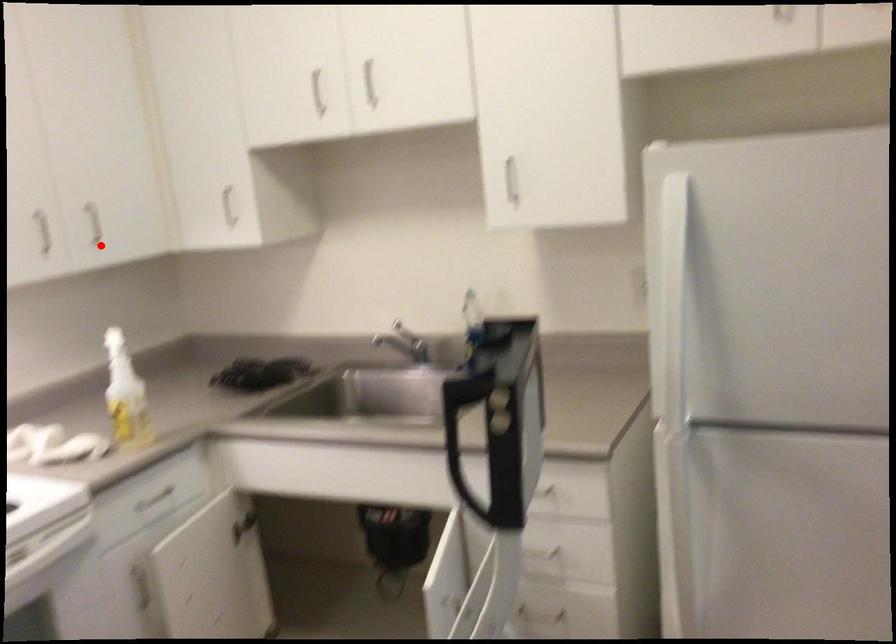
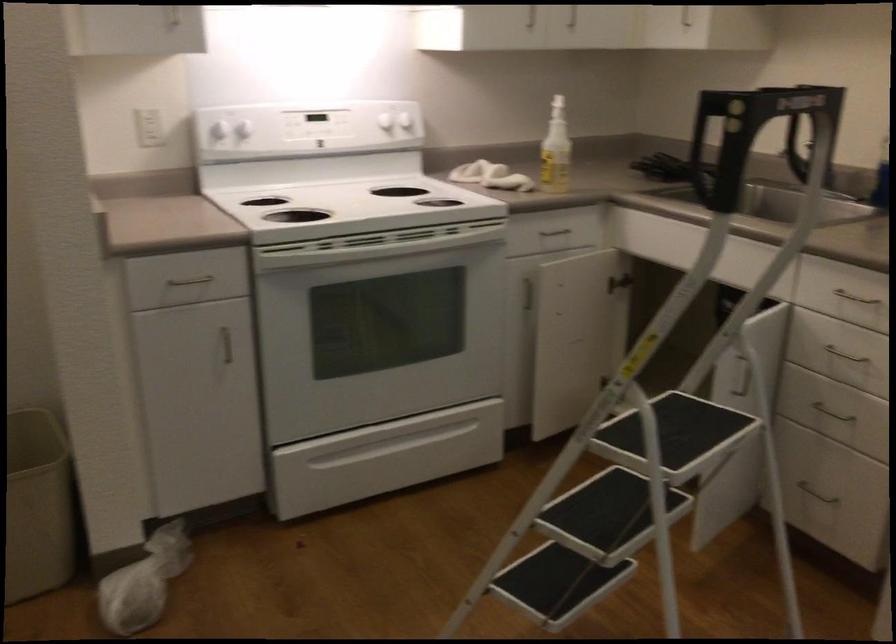
The point at the highlighted location is marked in the first image. Where is the corresponding point in the second image?

(573, 24)